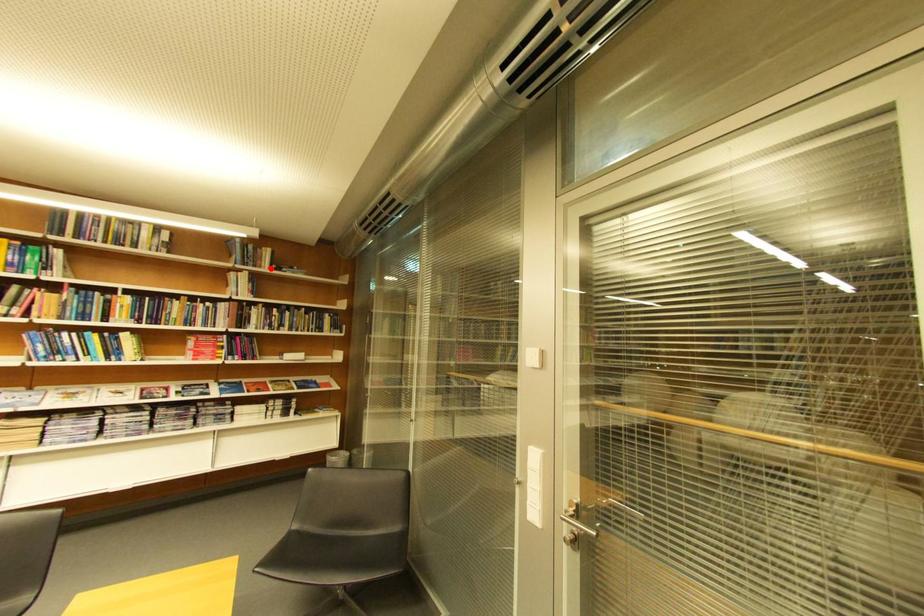
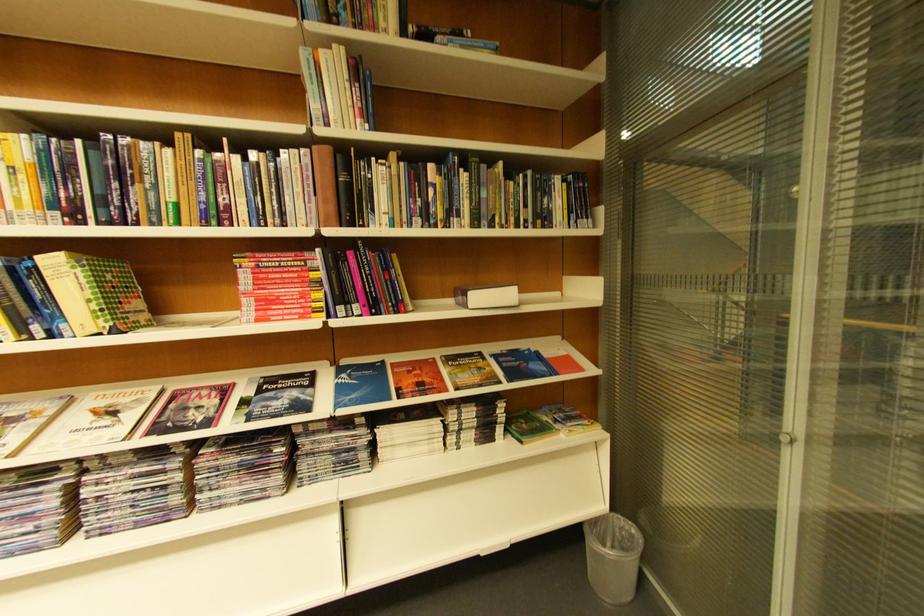
Find the pixel in the second image that matches the highlighted location in the first image.

(384, 31)